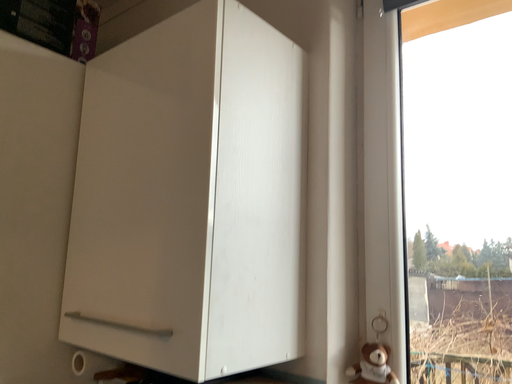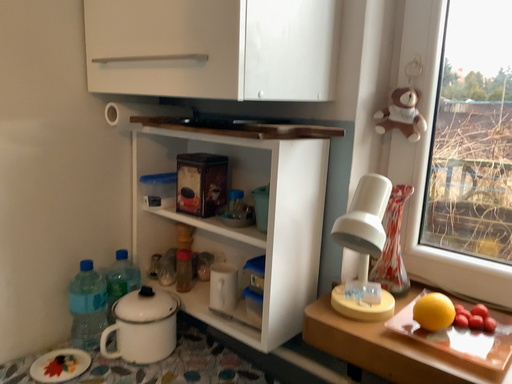
Question: Which way did the camera rotate in the video?

Choices:
 (A) rotated upward
 (B) rotated downward

Answer: (B)